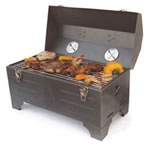
At what (x,y) coordinates should I click in order to perform the action: click on right latch. Please return your answer as a coordinate pair (x, y). Image resolution: width=150 pixels, height=147 pixels. Looking at the image, I should click on (84, 94).